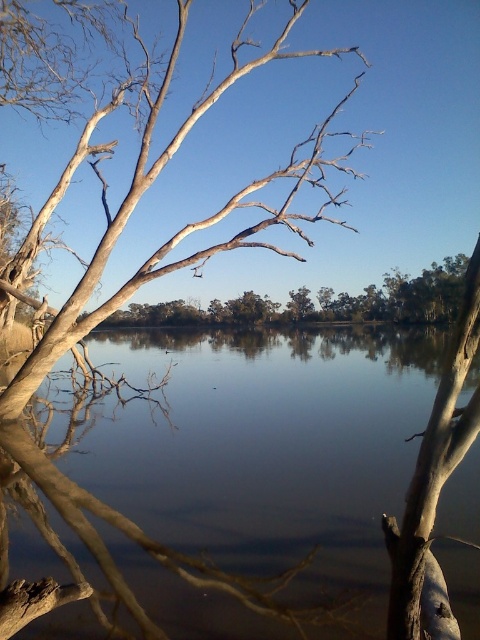
You are an artist trying to sketch this scene. You want to draw the smooth water at center first. Where should you place it relative to the white textured bark at upper right?

The smooth water at center should be placed to the right of the white textured bark at upper right.

You are an artist planning to paint the scene. You need to know which object is wider in the image for your composition. Which is wider between the smooth water at center and the white textured bark at upper right?

The smooth water at center is wider than the white textured bark at upper right according to the description.

You are an artist trying to paint this scene. You want to ensure that the smooth water at center and the white textured bark at upper right are proportionally accurate. Which object should you paint as taller in your artwork?

The white textured bark at upper right should be painted as taller because the smooth water at center has a lesser height compared to it.